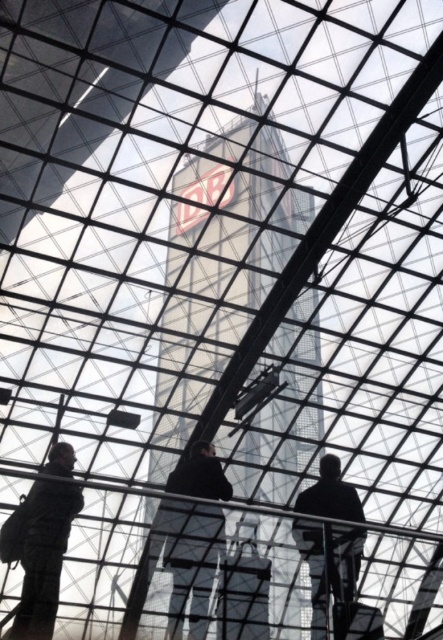
Which is more to the right, silhouette figure at lower left or black matte person at lower right?

Positioned to the right is black matte person at lower right.

Can you confirm if silhouette figure at lower left is positioned to the right of black matte person at lower right?

Incorrect, silhouette figure at lower left is not on the right side of black matte person at lower right.

I want to click on silhouette figure at lower left, so click(x=39, y=552).

Which is behind, point (171, 467) or point (46, 488)?

Point (171, 467)

Does transparent glass tower at center have a lesser width compared to silhouette figure at lower left?

In fact, transparent glass tower at center might be wider than silhouette figure at lower left.

Who is more distant from viewer, (197, 259) or (46, 612)?

The point (197, 259) is behind.

What are the coordinates of `transparent glass tower at center` in the screenshot? It's located at (220, 266).

Does point (70, 460) lie behind point (206, 458)?

No, (70, 460) is closer to viewer.

Does silhouette figure at lower left have a lesser height compared to dark clothing figure at center?

Indeed, silhouette figure at lower left has a lesser height compared to dark clothing figure at center.

The image size is (443, 640). I want to click on silhouette figure at lower left, so click(x=39, y=552).